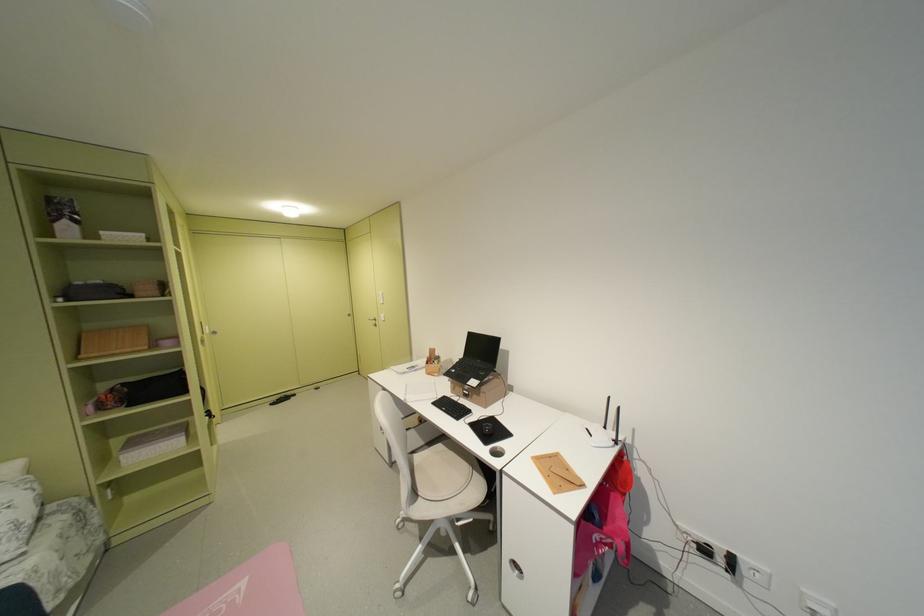
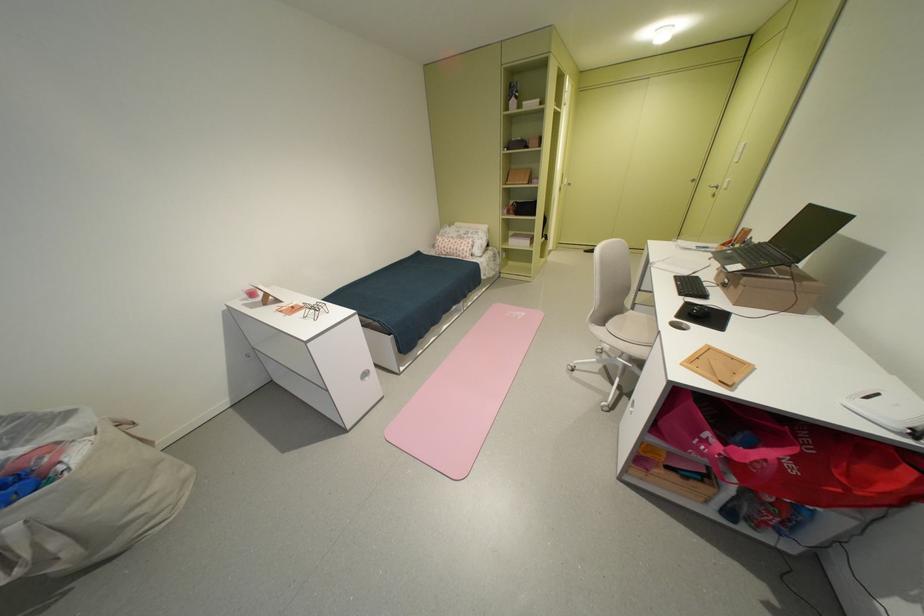
The point at (560, 458) is marked in the first image. Where is the corresponding point in the second image?

(743, 360)